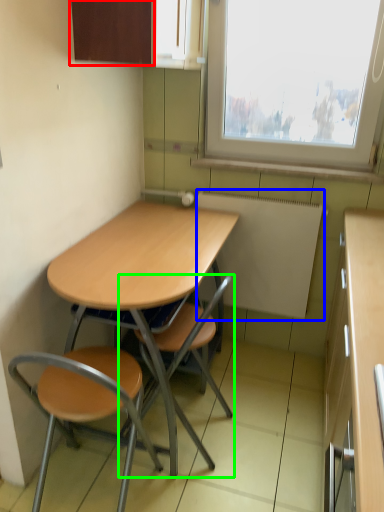
Question: Which object is positioned closest to cabinetry (highlighted by a red box)? Select from appliance (highlighted by a blue box) and chair (highlighted by a green box).

Choices:
 (A) appliance
 (B) chair

Answer: (A)